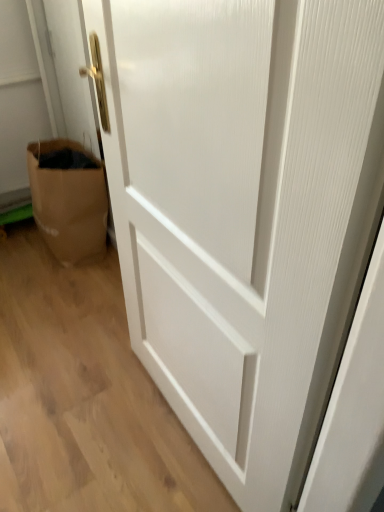
In order to click on vacant area in front of brown paper bag at lower left in this screenshot , I will do `click(58, 286)`.